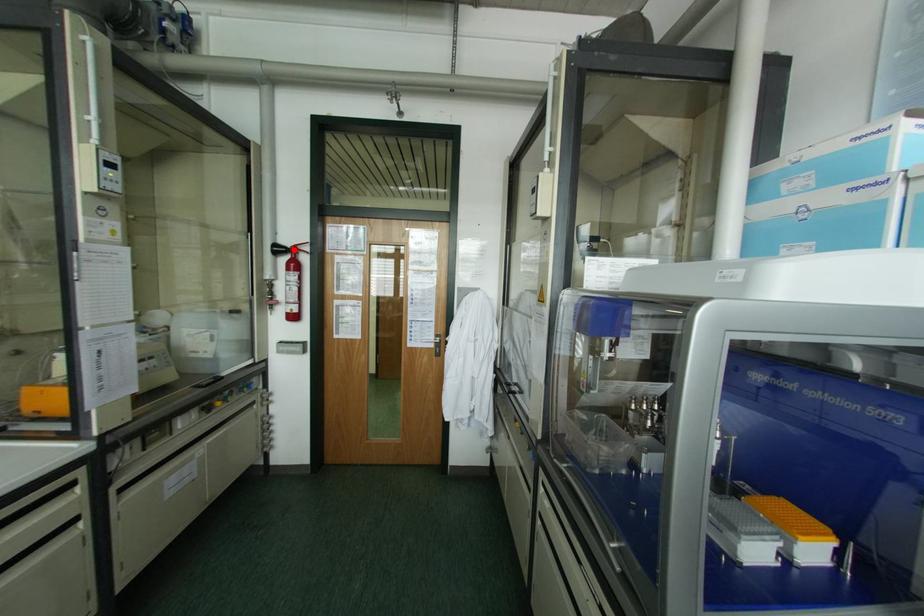
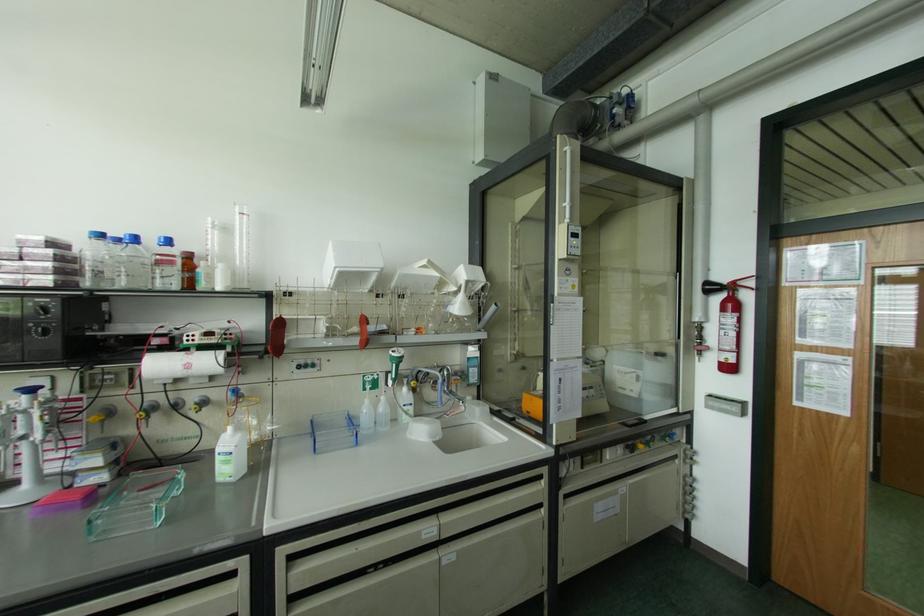
Locate, in the second image, the point that corresponds to the highlighted location in the first image.

(732, 286)